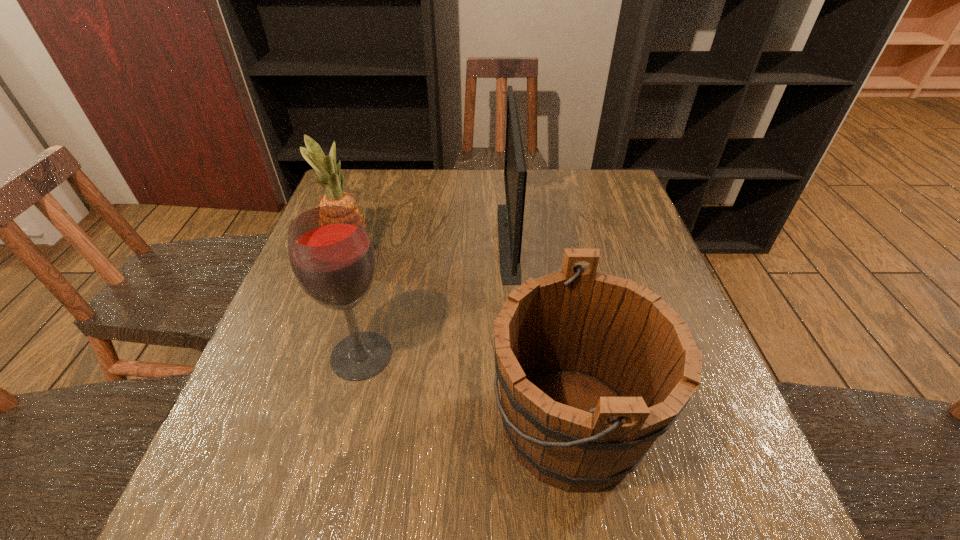
Locate an element on the screen. This screenshot has width=960, height=540. monitor is located at coordinates (510, 217).

I want to click on alcohol, so pyautogui.click(x=332, y=257).

The width and height of the screenshot is (960, 540). I want to click on pineapple, so click(325, 166).

Where is `wine bucket`? Image resolution: width=960 pixels, height=540 pixels. wine bucket is located at coordinates (593, 368).

This screenshot has height=540, width=960. I want to click on free space located 0.330m on the front-facing side of the monitor, so click(x=376, y=240).

Find the location of a particular element. Image resolution: width=960 pixels, height=540 pixels. vacant region located 0.230m on the front-facing side of the monitor is located at coordinates (413, 240).

The height and width of the screenshot is (540, 960). In order to click on vacant area situated on the front-facing side of the monitor in this screenshot , I will do `click(380, 240)`.

Locate an element on the screen. Image resolution: width=960 pixels, height=540 pixels. blank area located on the front of the alcohol is located at coordinates point(343,431).

What are the coordinates of `free space located on the right of the pineapple` in the screenshot? It's located at (460, 251).

Where is `vacant region located 0.080m on the side of the wine bucket with the handle for carrying`? Image resolution: width=960 pixels, height=540 pixels. vacant region located 0.080m on the side of the wine bucket with the handle for carrying is located at coordinates (447, 425).